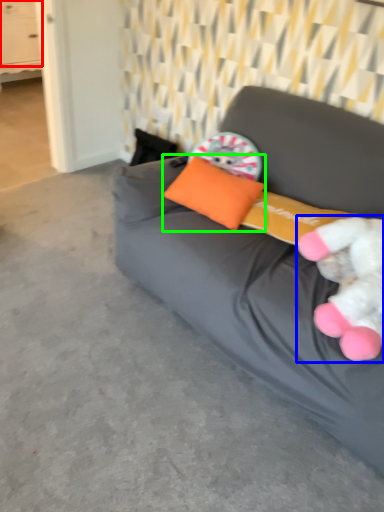
Question: Estimate the real-world distances between objects in this image. Which object is closer to drawer (highlighted by a red box), toy (highlighted by a blue box) or pillow (highlighted by a green box)?

Choices:
 (A) toy
 (B) pillow

Answer: (B)